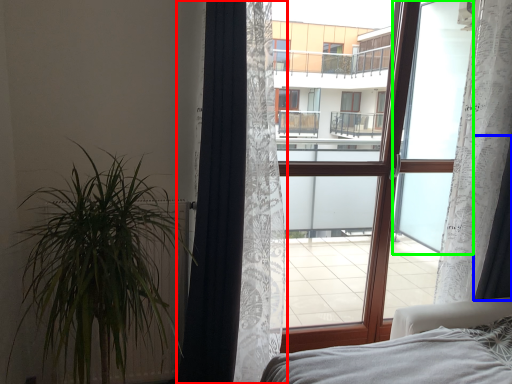
Question: Which object is the farthest from curtain (highlighted by a red box)? Choose among these: curtain (highlighted by a blue box) or window screen (highlighted by a green box).

Choices:
 (A) curtain
 (B) window screen

Answer: (A)